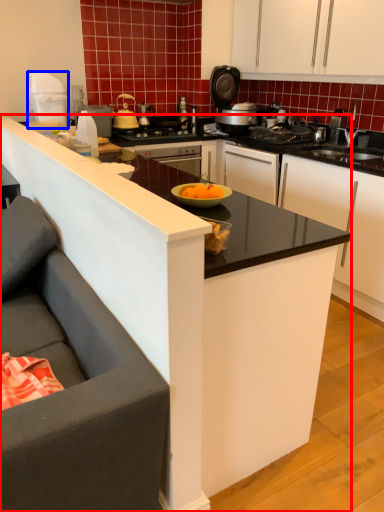
Question: Among these objects, which one is farthest to the camera, countertop (highlighted by a red box) or kitchen appliance (highlighted by a blue box)?

Choices:
 (A) countertop
 (B) kitchen appliance

Answer: (B)